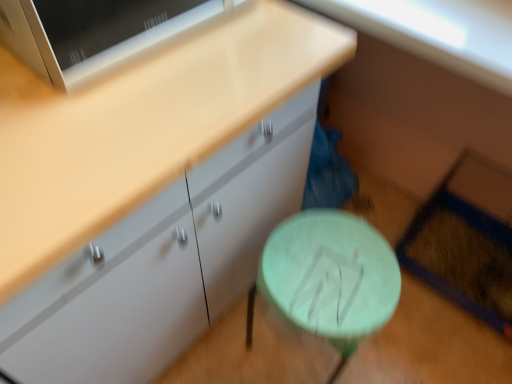
Question: Does matte white cabinet at center have a smaller size compared to green matte table at lower center?

Choices:
 (A) yes
 (B) no

Answer: (B)

Question: Is matte white cabinet at center not within green matte table at lower center?

Choices:
 (A) no
 (B) yes

Answer: (B)

Question: Considering the relative sizes of matte white cabinet at center and green matte table at lower center in the image provided, is matte white cabinet at center bigger than green matte table at lower center?

Choices:
 (A) no
 (B) yes

Answer: (B)

Question: Can you confirm if matte white cabinet at center is thinner than green matte table at lower center?

Choices:
 (A) no
 (B) yes

Answer: (A)

Question: Is green matte table at lower center completely or partially inside matte white cabinet at center?

Choices:
 (A) no
 (B) yes

Answer: (A)

Question: Considering the relative sizes of matte white cabinet at center and green matte table at lower center in the image provided, is matte white cabinet at center shorter than green matte table at lower center?

Choices:
 (A) no
 (B) yes

Answer: (A)

Question: From a real-world perspective, does green matte table at lower center sit lower than matte white cabinet at center?

Choices:
 (A) yes
 (B) no

Answer: (A)

Question: Can you confirm if green matte table at lower center is positioned to the left of matte white cabinet at center?

Choices:
 (A) no
 (B) yes

Answer: (A)

Question: Is green matte table at lower center at the right side of matte white cabinet at center?

Choices:
 (A) no
 (B) yes

Answer: (B)

Question: Is green matte table at lower center positioned before matte white cabinet at center?

Choices:
 (A) no
 (B) yes

Answer: (A)

Question: Is green matte table at lower center not near matte white cabinet at center?

Choices:
 (A) no
 (B) yes

Answer: (A)

Question: Is green matte table at lower center oriented towards matte white cabinet at center?

Choices:
 (A) yes
 (B) no

Answer: (B)

Question: Is green matte table at lower center taller or shorter than matte white cabinet at center?

Choices:
 (A) short
 (B) tall

Answer: (A)